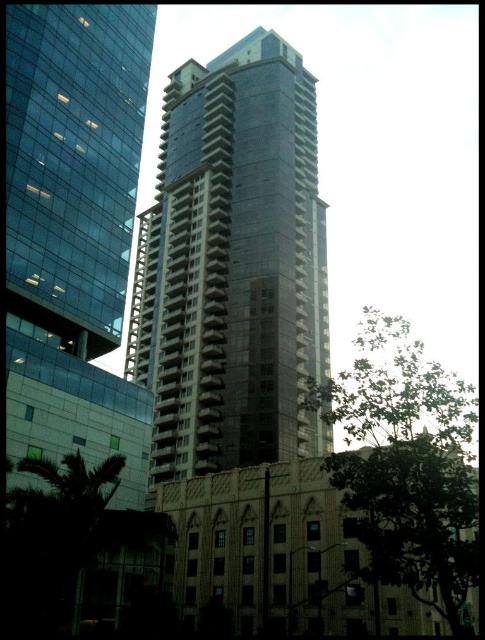
You are standing at the point with coordinates point (113, 547) and want to walk to the point with coordinates point (257, 92). Which direction should you move to reach your destination?

You should move backward to reach point (257, 92) because it is behind point (113, 547).

You are standing in the cityscape and want to take a photo of both the green leafy tree at center and the green leafy tree at lower left. Which tree should you focus on first to ensure both are in the frame?

You should focus on the green leafy tree at center first because it is closer to you, so adjusting the camera to include it will naturally include the green leafy tree at lower left which is farther away.

You are a drone operator tasked with capturing aerial footage of the city. Your drone is currently positioned at point A, which is at coordinates 0.3, 0.5. You need to fly the drone to the smooth glass tower at center. According to the image coordinates, is the tower to the north or south of your current position?

The smooth glass tower at center is located at point (232, 266). Since your current position is at (242, 192), the tower is to the south of your current position because the y coordinate of the tower is lower than yours.